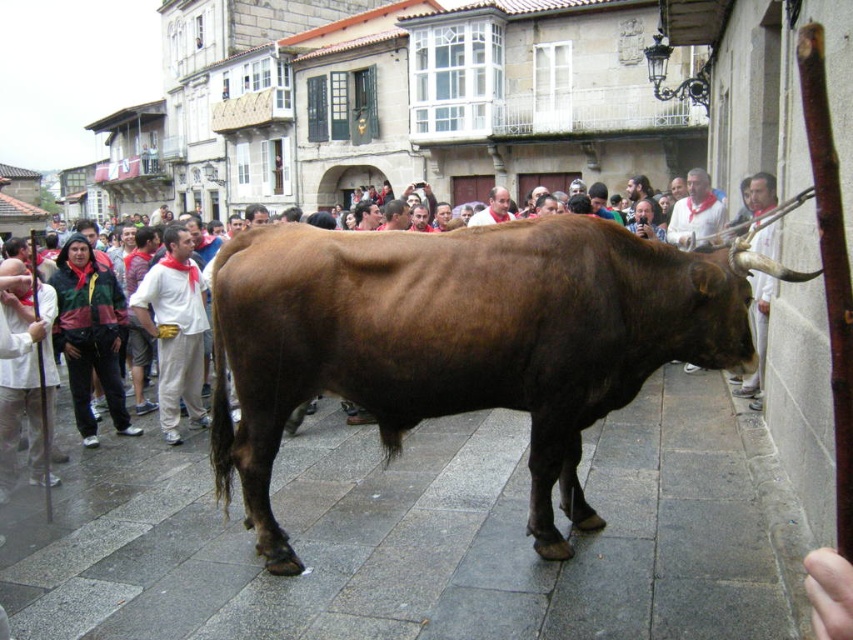
Question: Which point appears farthest from the camera in this image?

Choices:
 (A) (368, 474)
 (B) (444, 289)

Answer: (A)

Question: Does gray stone pavement at center have a lesser width compared to brown glossy cow at center?

Choices:
 (A) no
 (B) yes

Answer: (A)

Question: Observing the image, what is the correct spatial positioning of gray stone pavement at center in reference to brown glossy cow at center?

Choices:
 (A) above
 (B) below

Answer: (B)

Question: In this image, where is gray stone pavement at center located relative to brown glossy cow at center?

Choices:
 (A) right
 (B) left

Answer: (B)